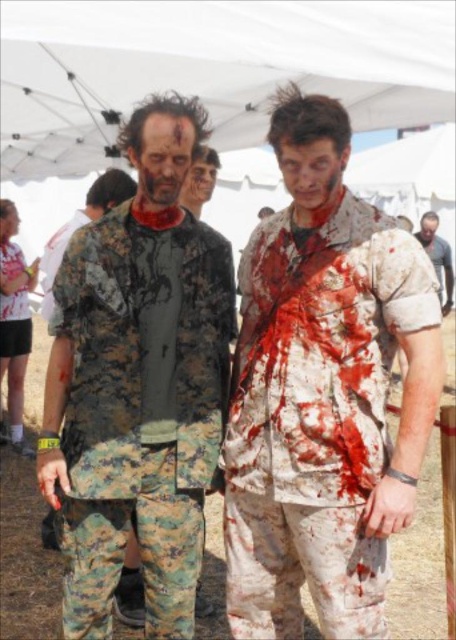
You are organizing a costume party and need to arrange the zombie costumes properly. The camouflage fabric shirt at left and the camouflage pants at center are part of the same outfit. Are the shirt and pants currently arranged in the correct order for someone to put them on?

The camouflage fabric shirt at left is positioned on the left side of camouflage pants at center. Since the shirt is typically worn over the pants, the current arrangement has the shirt to the left of the pants, which might not be the correct order for putting them on as the shirt should be placed over the pants, not beside them.

You are a costume designer preparing for a zombie walk event. You have two camouflage items to choose from for the upper body and lower body. The camouflage fabric shirt at center and camouflage pants at center. Which item should you pick for the upper body to ensure it fits snugly without being too tight?

The camouflage fabric shirt at center is thinner than the camouflage pants at center, so you should choose the camouflage fabric shirt at center for the upper body to ensure a snug fit without being too tight.